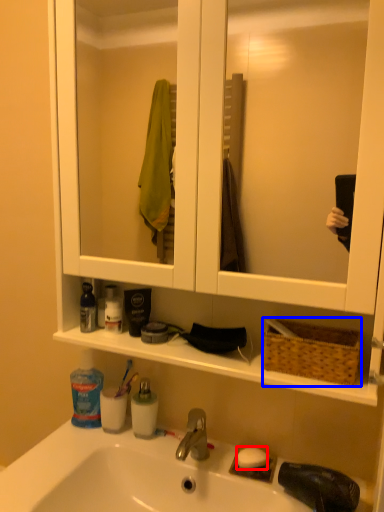
Question: Among these objects, which one is nearest to the camera, soap (highlighted by a red box) or picnic basket (highlighted by a blue box)?

Choices:
 (A) soap
 (B) picnic basket

Answer: (B)